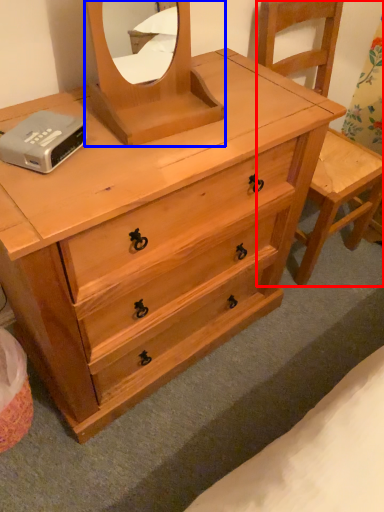
Question: Which object appears farthest to the camera in this image, armchair (highlighted by a red box) or mirror (highlighted by a blue box)?

Choices:
 (A) armchair
 (B) mirror

Answer: (A)